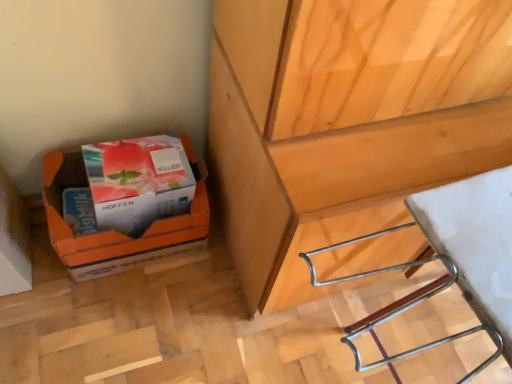
Question: Should I look upward or downward to see matte white box at lower left?

Choices:
 (A) up
 (B) down

Answer: (A)

Question: Does orange cardboard box at lower left have a lesser width compared to white plastic stool at lower right?

Choices:
 (A) no
 (B) yes

Answer: (B)

Question: Is orange cardboard box at lower left taller than white plastic stool at lower right?

Choices:
 (A) yes
 (B) no

Answer: (B)

Question: Can you confirm if orange cardboard box at lower left is positioned to the right of white plastic stool at lower right?

Choices:
 (A) yes
 (B) no

Answer: (B)

Question: From a real-world perspective, is orange cardboard box at lower left under white plastic stool at lower right?

Choices:
 (A) no
 (B) yes

Answer: (B)

Question: From the image's perspective, is orange cardboard box at lower left located beneath white plastic stool at lower right?

Choices:
 (A) yes
 (B) no

Answer: (B)

Question: Is white plastic stool at lower right a part of orange cardboard box at lower left?

Choices:
 (A) no
 (B) yes

Answer: (A)

Question: Is orange cardboard box at lower left smaller than matte white box at lower left?

Choices:
 (A) no
 (B) yes

Answer: (A)

Question: From a real-world perspective, is orange cardboard box at lower left positioned over matte white box at lower left based on gravity?

Choices:
 (A) yes
 (B) no

Answer: (B)

Question: Does orange cardboard box at lower left have a greater height compared to matte white box at lower left?

Choices:
 (A) yes
 (B) no

Answer: (A)

Question: Is orange cardboard box at lower left touching matte white box at lower left?

Choices:
 (A) yes
 (B) no

Answer: (B)

Question: Is orange cardboard box at lower left positioned far away from matte white box at lower left?

Choices:
 (A) yes
 (B) no

Answer: (B)

Question: Is matte white box at lower left located within orange cardboard box at lower left?

Choices:
 (A) no
 (B) yes

Answer: (B)

Question: Does white plastic stool at lower right contain orange cardboard box at lower left?

Choices:
 (A) no
 (B) yes

Answer: (A)